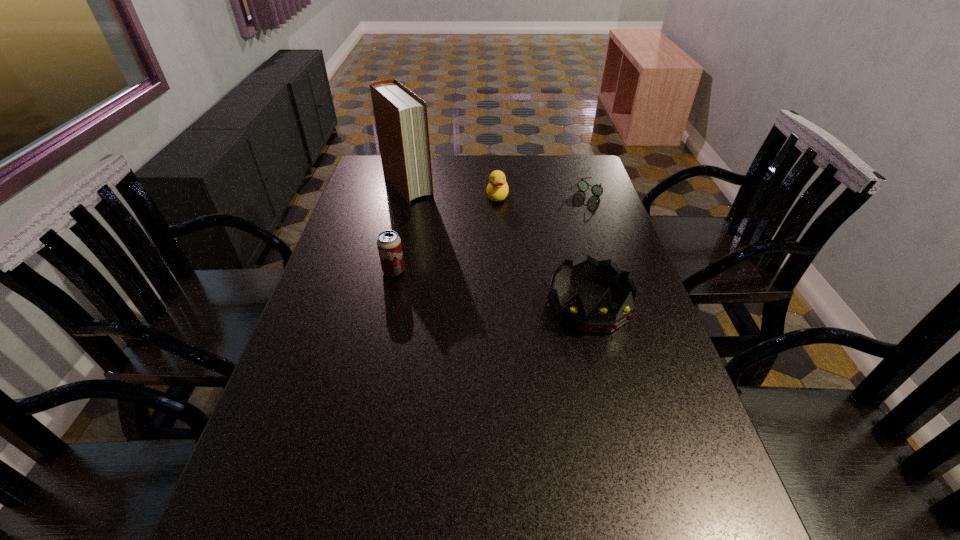
The height and width of the screenshot is (540, 960). What are the coordinates of `vacant region located 0.290m on the face of the second shortest object` in the screenshot? It's located at pyautogui.click(x=488, y=258).

You are a GUI agent. You are given a task and a screenshot of the screen. Output one action in this format:
    pyautogui.click(x=<x>, y=<y>)
    Task: Click on the free space located 0.190m on the open cover of the hardback book
    
    Given the screenshot: What is the action you would take?
    pyautogui.click(x=444, y=231)

I want to click on vacant area situated 0.130m on the open cover of the hardback book, so click(436, 221).

Locate an element on the screen. vacant space located on the open cover of the hardback book is located at coordinates (467, 256).

This screenshot has width=960, height=540. I want to click on free region located 0.290m on the front-facing side of the spectacles, so click(529, 253).

Identify the location of vacant space located on the front-facing side of the spectacles. (529, 253).

I want to click on free space located on the front-facing side of the spectacles, so click(x=532, y=250).

The width and height of the screenshot is (960, 540). Find the location of `hardback book that is at the far edge`. hardback book that is at the far edge is located at coordinates (401, 118).

The width and height of the screenshot is (960, 540). What are the coordinates of `spectacles that is at the far edge` in the screenshot? It's located at (597, 190).

At what (x,y) coordinates should I click in order to perform the action: click on object that is at the left edge. Please return your answer as a coordinate pair (x, y). This screenshot has height=540, width=960. Looking at the image, I should click on (401, 118).